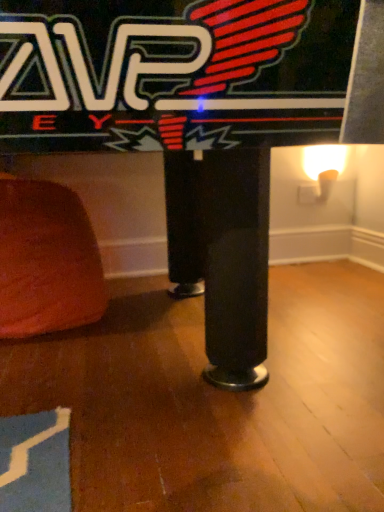
Image resolution: width=384 pixels, height=512 pixels. Describe the element at coordinates (46, 260) in the screenshot. I see `matte brown ottoman at lower left` at that location.

The height and width of the screenshot is (512, 384). What are the coordinates of `matte brown ottoman at lower left` in the screenshot? It's located at (46, 260).

Image resolution: width=384 pixels, height=512 pixels. Find the location of `matte brown ottoman at lower left`. matte brown ottoman at lower left is located at coordinates (46, 260).